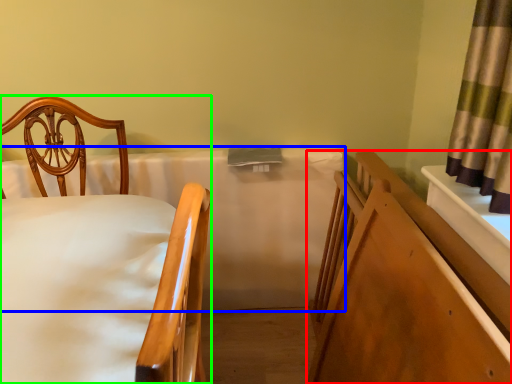
Question: Which object is positioned closest to bed frame (highlighted by a red box)? Select from mattress (highlighted by a blue box) and chair (highlighted by a green box).

Choices:
 (A) mattress
 (B) chair

Answer: (A)